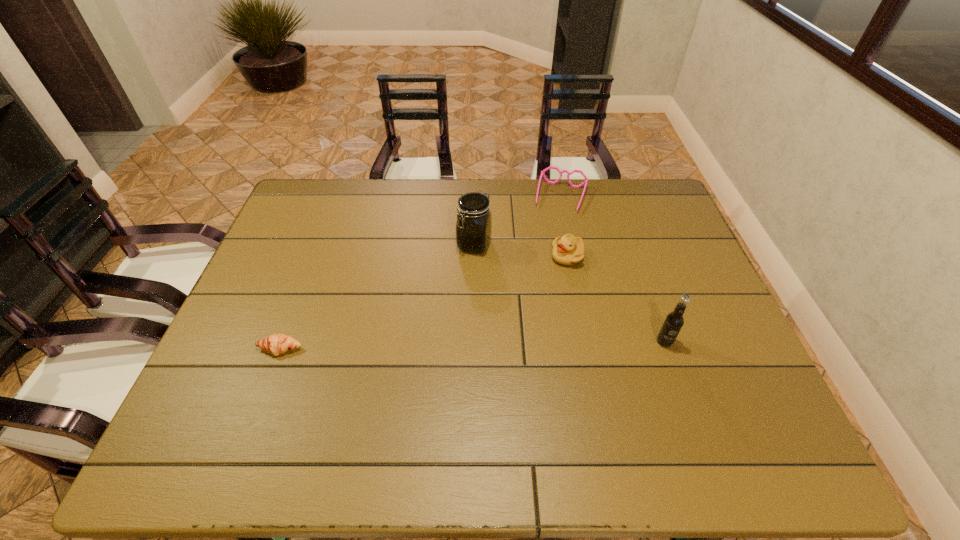
Where is `pastry`? pastry is located at coordinates (275, 344).

This screenshot has width=960, height=540. In order to click on the shortest object in this screenshot , I will do `click(275, 344)`.

The height and width of the screenshot is (540, 960). I want to click on root beer, so click(673, 322).

Locate an element on the screen. Image resolution: width=960 pixels, height=540 pixels. the fourth object from right to left is located at coordinates (474, 219).

Where is `the second shortest object`? The width and height of the screenshot is (960, 540). the second shortest object is located at coordinates (585, 182).

What are the coordinates of `spectacles` in the screenshot? It's located at (585, 182).

Locate an element on the screen. This screenshot has width=960, height=540. duckling is located at coordinates (568, 250).

Locate an element on the screen. This screenshot has height=540, width=960. vacant space situated on the front-facing side of the pastry is located at coordinates pyautogui.click(x=263, y=395).

Where is `free space located on the lid of the jar`? The height and width of the screenshot is (540, 960). free space located on the lid of the jar is located at coordinates (450, 303).

Where is `free space located on the lid of the jar`? free space located on the lid of the jar is located at coordinates (428, 357).